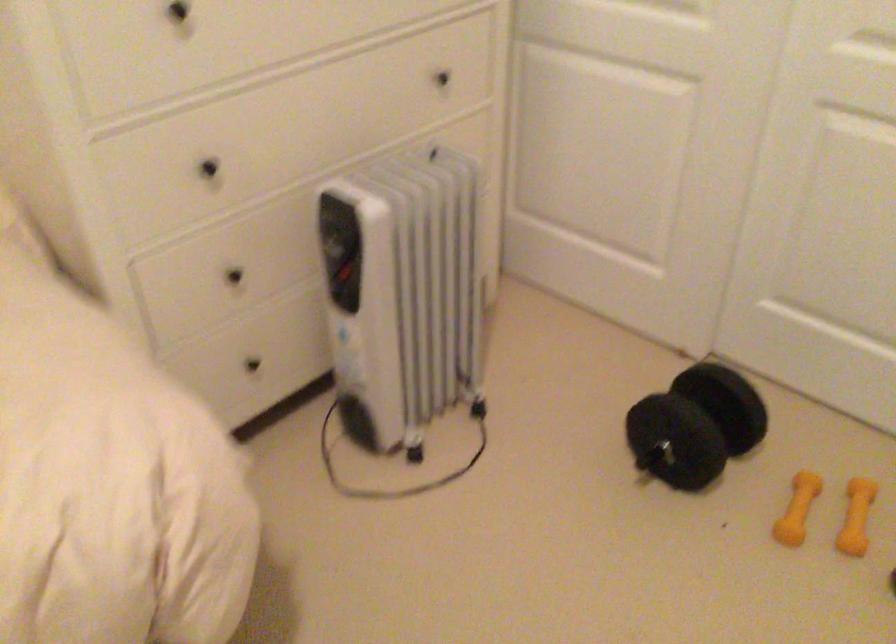
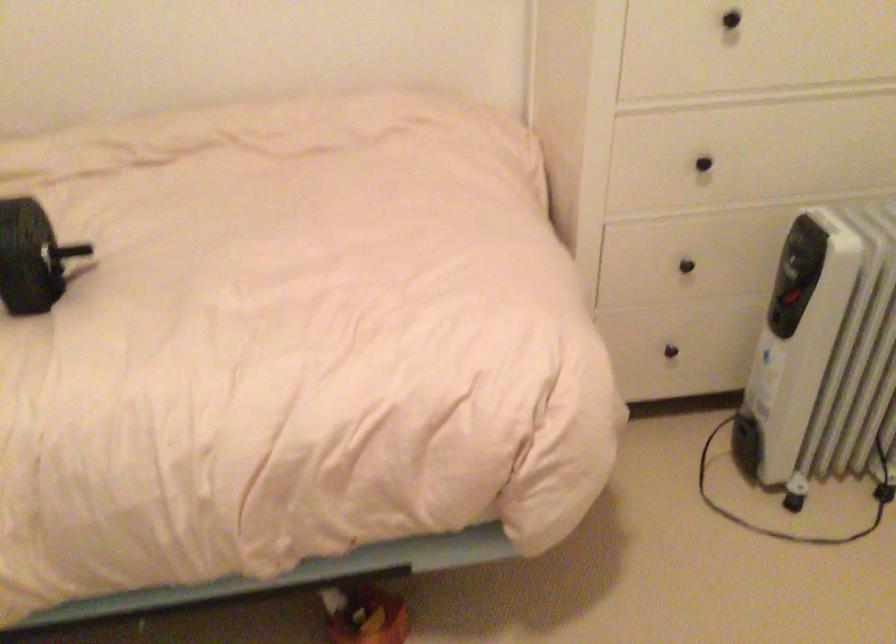
Where in the second image is the point corresponding to the point at 231,277 from the first image?

(685, 266)